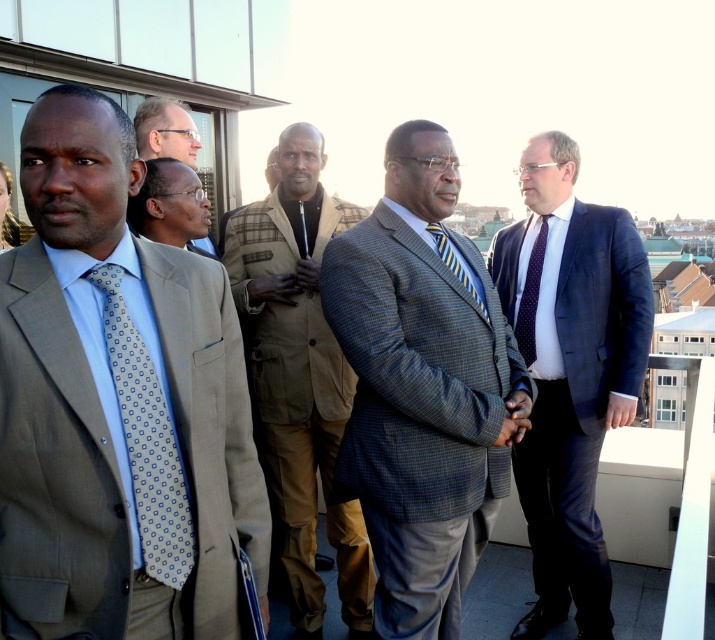
You are organizing a photo shoot and need to arrange the outfits from smallest to largest based on their sizes in the image. Given the light brown suit at center and the striped silk tie at center, which one should come first?

The light brown suit at center is smaller than the striped silk tie at center, so it should come first in the arrangement from smallest to largest.

You are a photographer trying to capture a closeup of the two points in the image. Which point, point (138, 504) or point (547, 216), is closer to your camera?

Point (138, 504) is closer to the camera than point (547, 216).